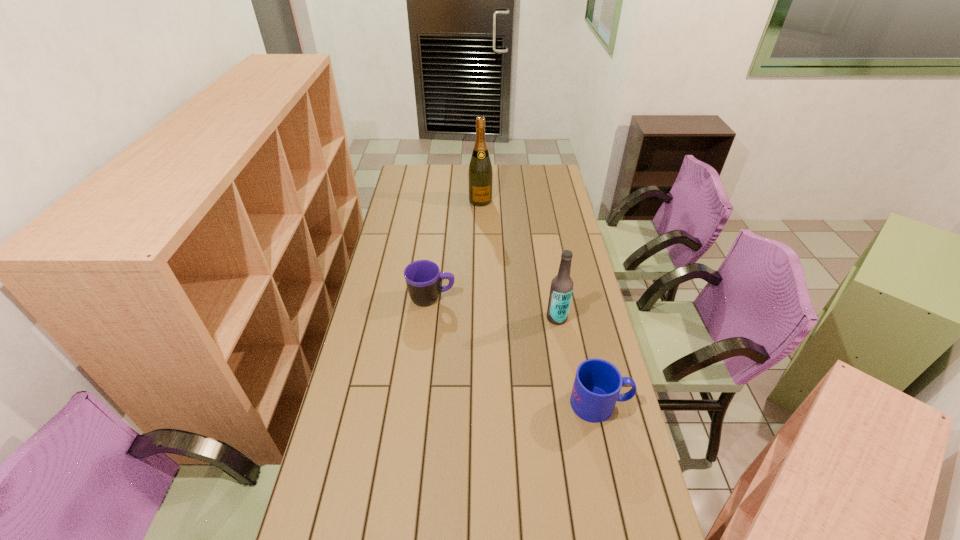
Find the location of `vacant area at the far right corner of the desktop`. vacant area at the far right corner of the desktop is located at coordinates (558, 178).

Locate an element on the screen. This screenshot has width=960, height=540. blank region between the nearest object and the left mug is located at coordinates (516, 350).

At what (x,y) coordinates should I click in order to perform the action: click on unoccupied position between the nearer mug and the beer bottle. Please return your answer as a coordinate pair (x, y). Looking at the image, I should click on (579, 361).

Locate an element on the screen. The image size is (960, 540). unoccupied position between the right mug and the third shortest object is located at coordinates (579, 361).

In order to click on blank region between the right mug and the third shortest object in this screenshot , I will do `click(579, 361)`.

This screenshot has height=540, width=960. What are the coordinates of `vacant area between the farthest object and the leftmost object` in the screenshot? It's located at (456, 249).

You are a GUI agent. You are given a task and a screenshot of the screen. Output one action in this format:
    pyautogui.click(x=<x>, y=<y>)
    Task: Click on the empty location between the third shortest object and the tallest object
    Image resolution: width=960 pixels, height=540 pixels.
    Given the screenshot: What is the action you would take?
    pyautogui.click(x=518, y=259)

Find the location of a particular element. The image size is (960, 540). free space between the farthest object and the left mug is located at coordinates point(456,249).

Identify the location of vacant area that lies between the second tallest object and the second object from left to right. The image size is (960, 540). (518, 259).

Identify the location of vacant area that lies between the leftmost object and the nearer mug. Image resolution: width=960 pixels, height=540 pixels. pos(516,350).